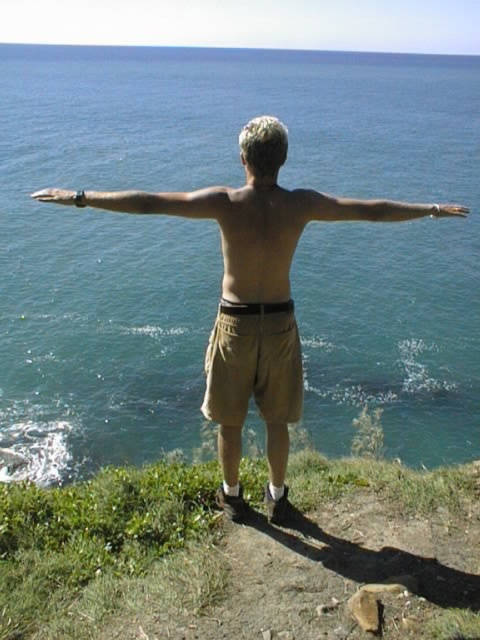
You are a photographer trying to capture the scene of the person on the cliff. You notice the green grass at lower center and the matte black watch at upper left in your viewfinder. Which object is closer to the bottom edge of your photo?

The green grass at lower center is closer to the bottom edge of the photo because it is positioned under the matte black watch at upper left.